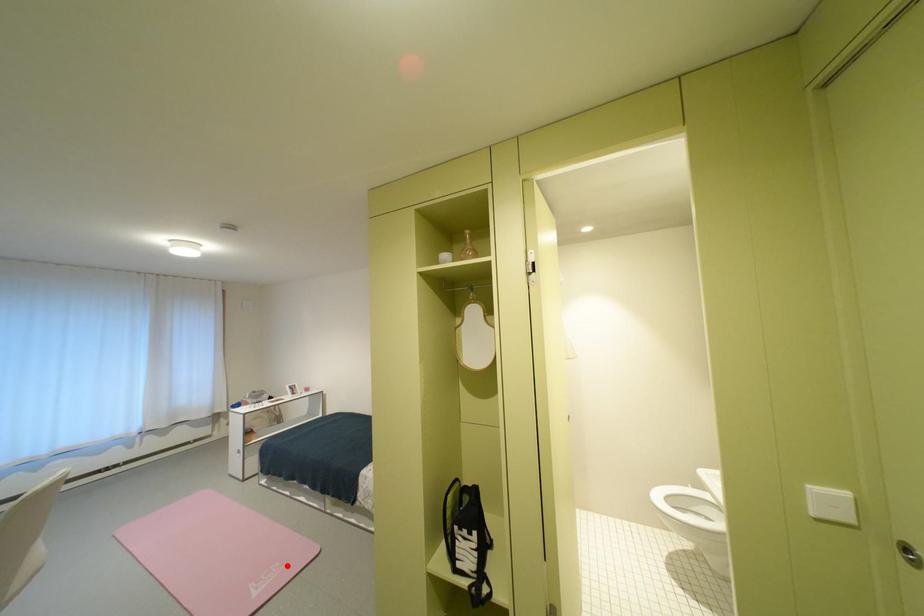
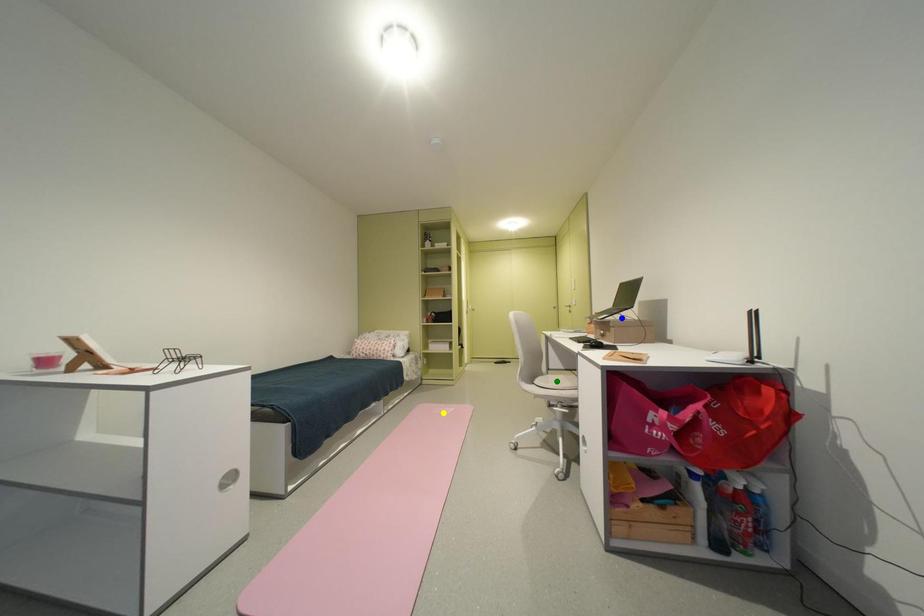
Question: I am providing you with two images of the same scene from different viewpoints. A red point is marked on the first image. You are given multiple points on the second image. Which mark in image 2 goes with the point in image 1?

Choices:
 (A) green point
 (B) blue point
 (C) yellow point

Answer: (C)